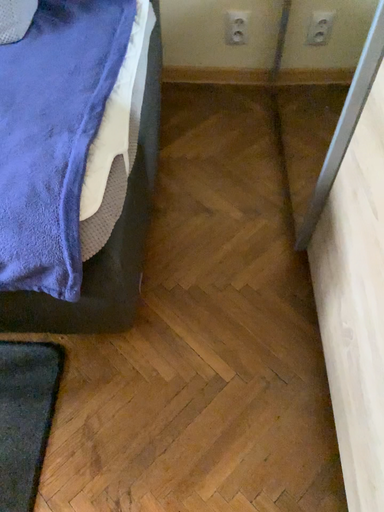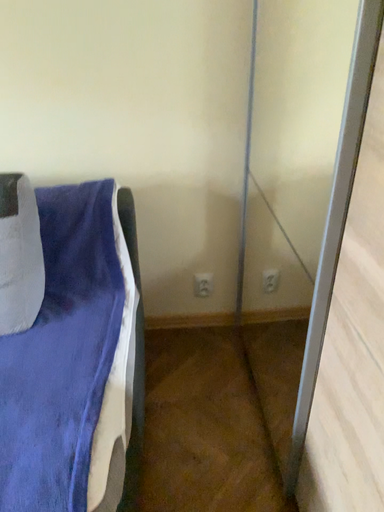
Question: Which way did the camera rotate in the video?

Choices:
 (A) rotated downward
 (B) rotated upward

Answer: (B)